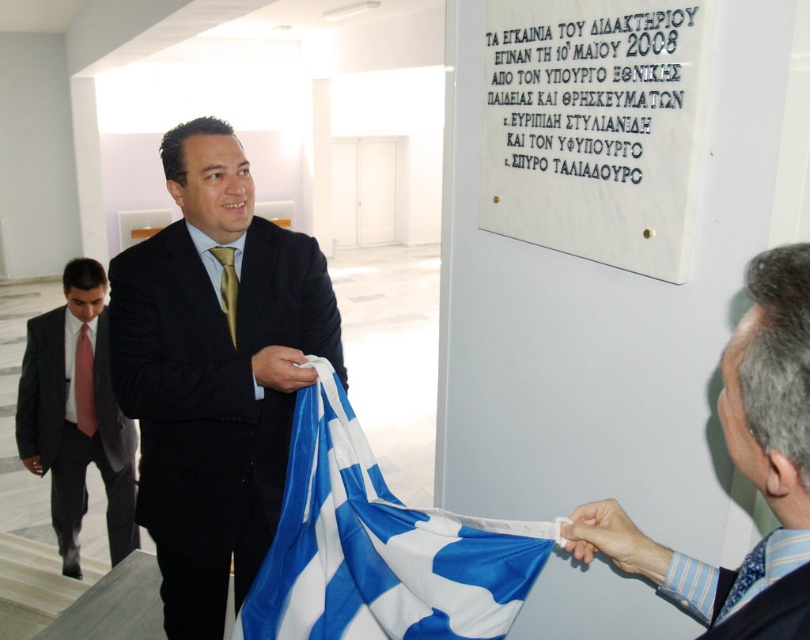
Is blue silk tie at upper right behind red satin tie at center?

No.

At what (x,y) coordinates should I click in order to perform the action: click on blue silk tie at upper right. Please return your answer as a coordinate pair (x, y). Image resolution: width=810 pixels, height=640 pixels. Looking at the image, I should click on (742, 470).

I want to click on blue silk tie at upper right, so click(742, 470).

Is point (229, 445) more distant than point (233, 264)?

No, it is in front of (233, 264).

Consider the image. Does black satin suit at center have a smaller size compared to gold silk tie at center?

Incorrect, black satin suit at center is not smaller in size than gold silk tie at center.

Who is more forward, (164,392) or (231,294)?

Point (164,392) is in front.

Where is `black satin suit at center`? black satin suit at center is located at coordinates (212, 372).

Which of these two, black satin suit at center or dark gray suit at left, stands taller?

With more height is dark gray suit at left.

Can you confirm if black satin suit at center is smaller than dark gray suit at left?

Yes, black satin suit at center is smaller than dark gray suit at left.

Between point (244, 284) and point (126, 467), which one is positioned behind?

Positioned behind is point (126, 467).

Where is `black satin suit at center`? black satin suit at center is located at coordinates 212,372.